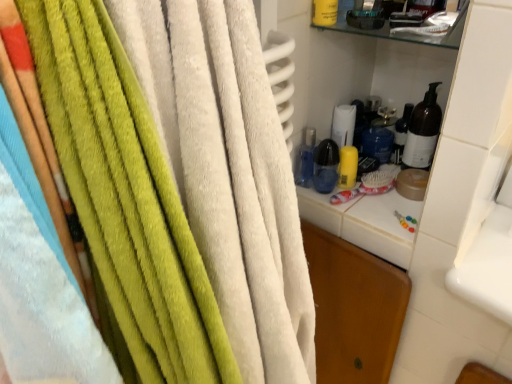
Question: Does soft green towel at left have a lesser height compared to transparent plastic bottle at center?

Choices:
 (A) no
 (B) yes

Answer: (A)

Question: Would you say soft green towel at left is a long distance from transparent plastic bottle at center?

Choices:
 (A) yes
 (B) no

Answer: (B)

Question: Can you confirm if soft green towel at left is positioned to the right of transparent plastic bottle at center?

Choices:
 (A) no
 (B) yes

Answer: (A)

Question: Is soft green towel at left bigger than transparent plastic bottle at center?

Choices:
 (A) no
 (B) yes

Answer: (B)

Question: Is soft green towel at left positioned in front of transparent plastic bottle at center?

Choices:
 (A) no
 (B) yes

Answer: (B)

Question: From a real-world perspective, is soft green towel at left physically above transparent plastic bottle at center?

Choices:
 (A) yes
 (B) no

Answer: (A)

Question: Considering the relative sizes of transparent plastic bottle at center and soft green towel at left in the image provided, is transparent plastic bottle at center thinner than soft green towel at left?

Choices:
 (A) no
 (B) yes

Answer: (B)

Question: Can you confirm if transparent plastic bottle at center is shorter than soft green towel at left?

Choices:
 (A) no
 (B) yes

Answer: (B)

Question: Are transparent plastic bottle at center and soft green towel at left located far from each other?

Choices:
 (A) yes
 (B) no

Answer: (B)

Question: From a real-world perspective, is transparent plastic bottle at center physically above soft green towel at left?

Choices:
 (A) no
 (B) yes

Answer: (A)

Question: Is transparent plastic bottle at center behind soft green towel at left?

Choices:
 (A) no
 (B) yes

Answer: (B)

Question: Is transparent plastic bottle at center turned away from soft green towel at left?

Choices:
 (A) no
 (B) yes

Answer: (A)

Question: Considering the relative positions of soft green towel at left and transparent plastic bottle at center in the image provided, is soft green towel at left to the left or to the right of transparent plastic bottle at center?

Choices:
 (A) right
 (B) left

Answer: (B)